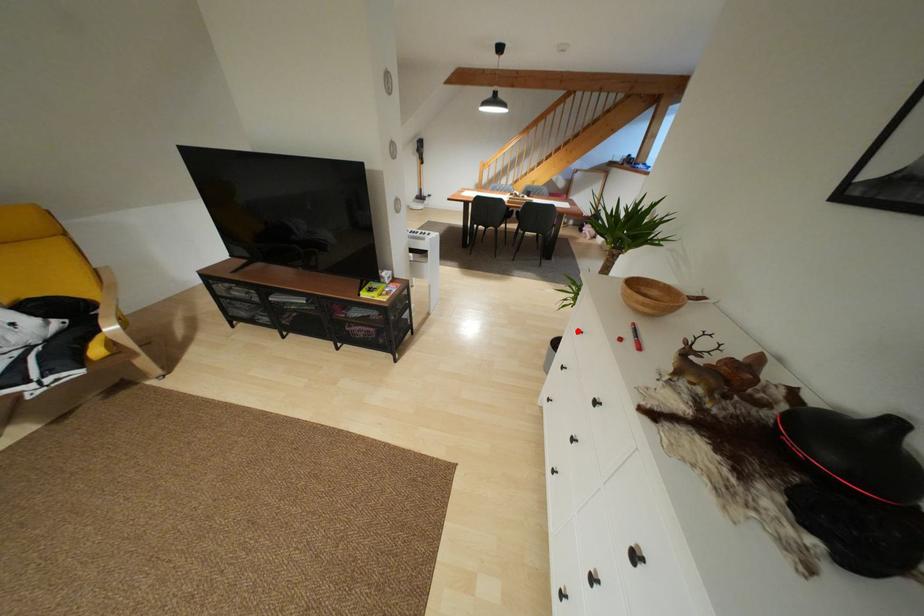
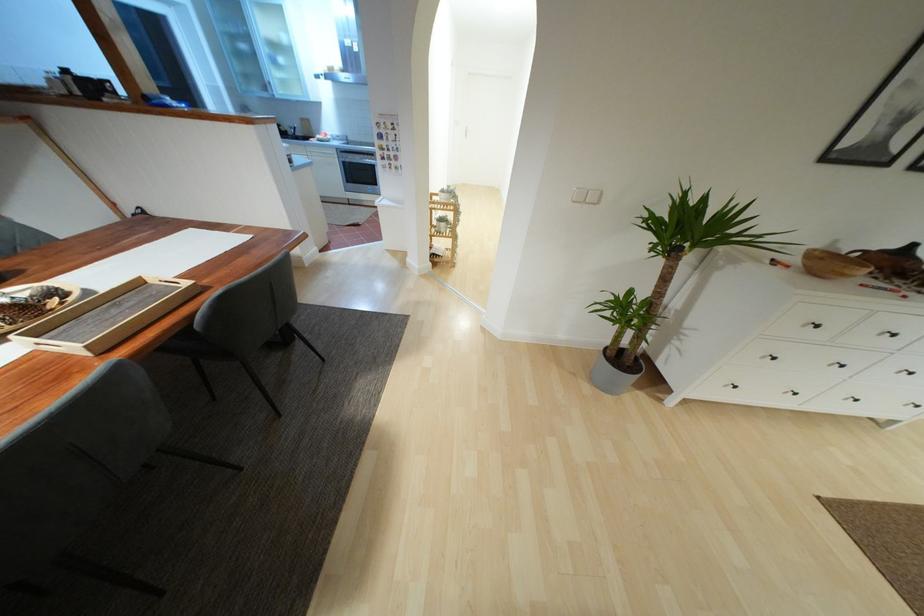
Question: I am providing you with two images of the same scene from different viewpoints. In image1, a red point is highlighted. Considering the same 3D point in image2, which of the following is correct?

Choices:
 (A) It is closer
 (B) It is farther

Answer: (B)